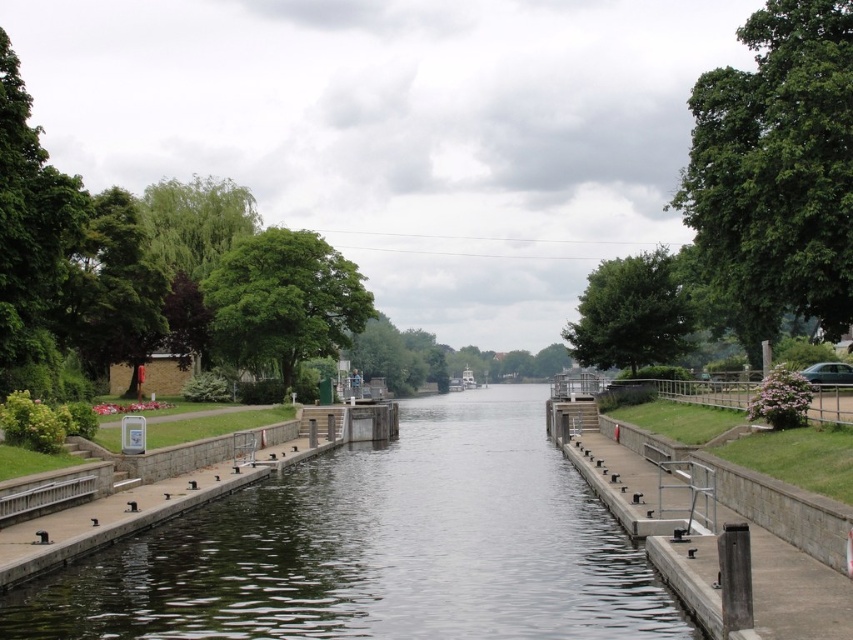
You are a photographer standing on the left bank of the canal. You want to capture a photo of the dark green water at center and the green leafy tree at center. Which object will appear closer to the bottom of your photo?

The dark green water at center is positioned under the green leafy tree at center, so in the photo, the dark green water at center will appear closer to the bottom of the photo.

You are a photographer standing at the edge of the canal. You want to capture a photo that includes both the dark green water at center and the green leafy tree at upper right. Based on their positions, which object should you focus on first to ensure both are in the frame?

The dark green water at center is below the green leafy tree at upper right, so you should focus on the green leafy tree at upper right first to ensure both are in the frame.

You are standing at the center of the canal and want to determine the visibility of two points. The first point is point (534,458) and the second is point (712,227). Based on their positions, which point is more likely to be visible from your current position?

Point (712,227) is more likely to be visible because it is in front of point (534,458), which is behind it.